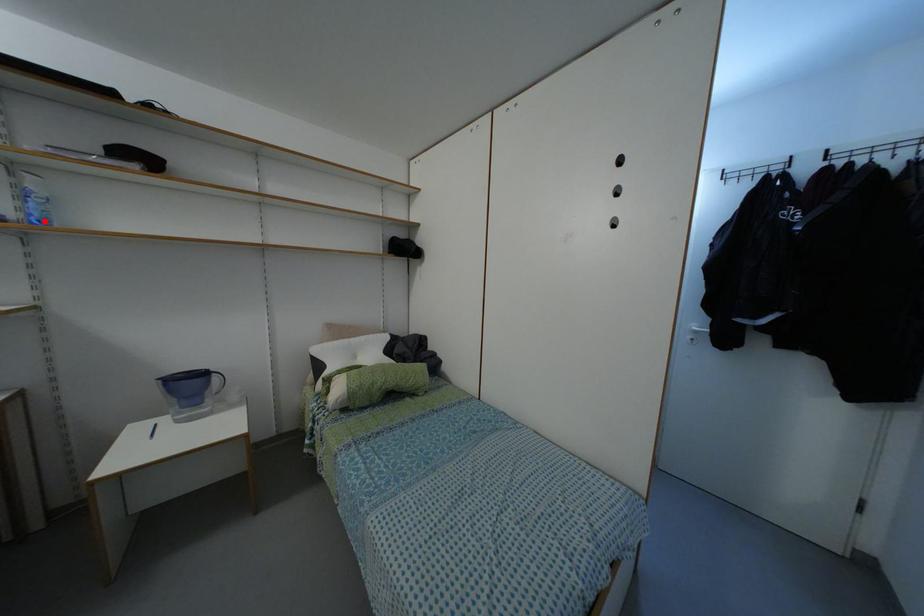
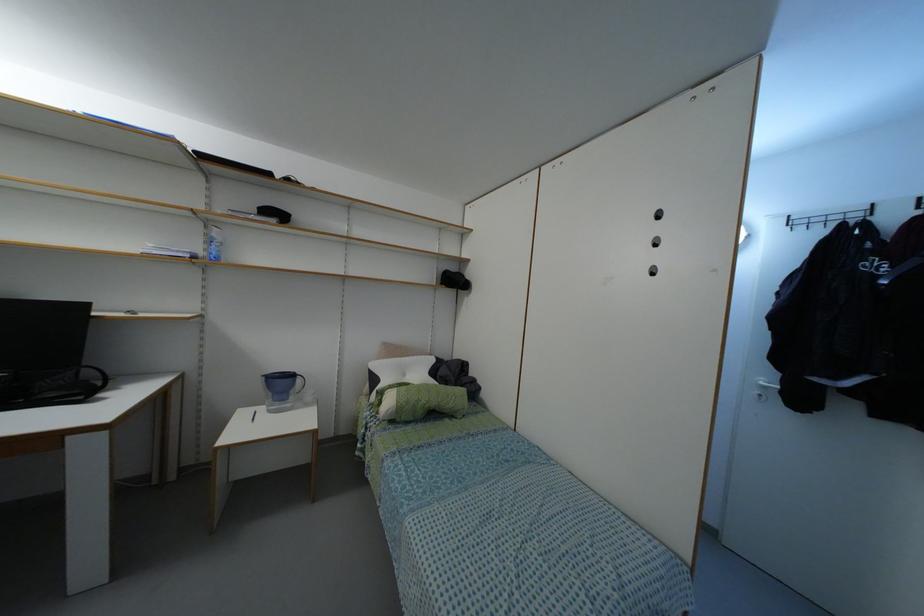
The point at the highlighted location is marked in the first image. Where is the corresponding point in the second image?

(216, 257)